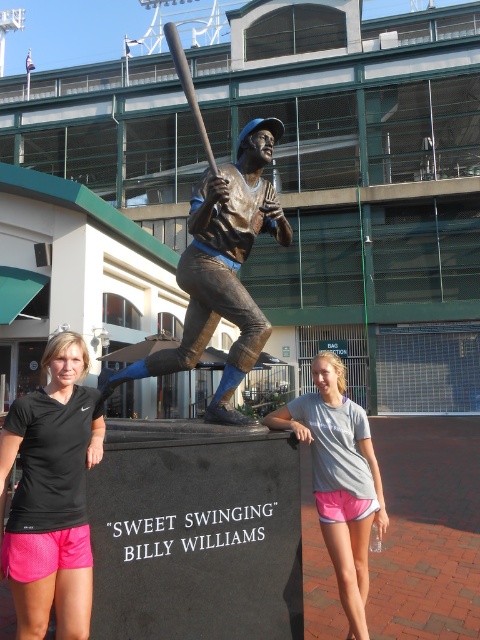
Does black nike dri-fit shirt at center appear on the right side of bronze statue at center?

In fact, black nike dri-fit shirt at center is to the left of bronze statue at center.

Does black nike dri-fit shirt at center have a lesser width compared to bronze statue at center?

No.

This screenshot has height=640, width=480. In order to click on black nike dri-fit shirt at center in this screenshot , I will do `click(51, 493)`.

Is black athletic wear at center below bronze metallic bat at center?

Yes.

Can you confirm if black athletic wear at center is thinner than bronze metallic bat at center?

In fact, black athletic wear at center might be wider than bronze metallic bat at center.

What do you see at coordinates (124, 506) in the screenshot? The image size is (480, 640). I see `black athletic wear at center` at bounding box center [124, 506].

The image size is (480, 640). In order to click on black athletic wear at center in this screenshot , I will do `click(124, 506)`.

Can you confirm if bronze statue at center is bigger than bronze metallic bat at center?

Actually, bronze statue at center might be smaller than bronze metallic bat at center.

At what (x,y) coordinates should I click in order to perform the action: click on bronze statue at center. Please return your answer as a coordinate pair (x, y). Looking at the image, I should click on (222, 269).

Locate an element on the screen. bronze statue at center is located at coordinates (222, 269).